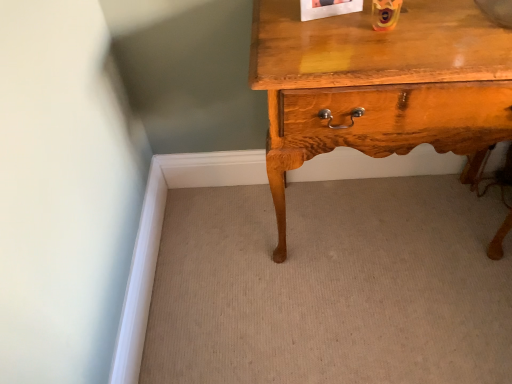
The width and height of the screenshot is (512, 384). I want to click on free location in front of glossy wood nightstand at right, so click(400, 318).